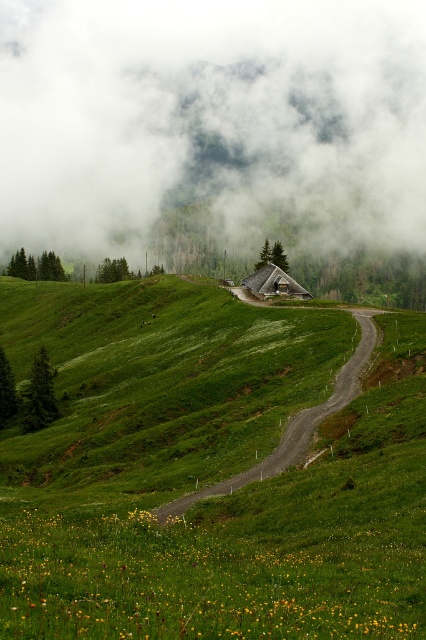
Does white fluffy cloud at upper center lie in front of gravel road at center?

No, white fluffy cloud at upper center is further to the viewer.

Is white fluffy cloud at upper center thinner than gravel road at center?

No, white fluffy cloud at upper center is not thinner than gravel road at center.

Who is more forward, (141,32) or (281,467)?

Point (281,467) is more forward.

At what (x,y) coordinates should I click in order to perform the action: click on white fluffy cloud at upper center. Please return your answer as a coordinate pair (x, y). The image size is (426, 640). Looking at the image, I should click on (213, 122).

Is point (230, 147) more distant than point (276, 292)?

Yes, point (230, 147) is farther from viewer.

Which is behind, point (328, 81) or point (265, 282)?

Point (328, 81)

The image size is (426, 640). I want to click on white fluffy cloud at upper center, so click(x=213, y=122).

In the scene shown: Does green grassy hillside at center have a lesser width compared to white fluffy cloud at upper center?

Yes.

Does green grassy hillside at center have a greater width compared to white fluffy cloud at upper center?

No, green grassy hillside at center is not wider than white fluffy cloud at upper center.

Who is more forward, (x=408, y=568) or (x=106, y=243)?

Point (x=408, y=568)

Image resolution: width=426 pixels, height=640 pixels. Find the location of `green grassy hillside at center`. green grassy hillside at center is located at coordinates (x=207, y=472).